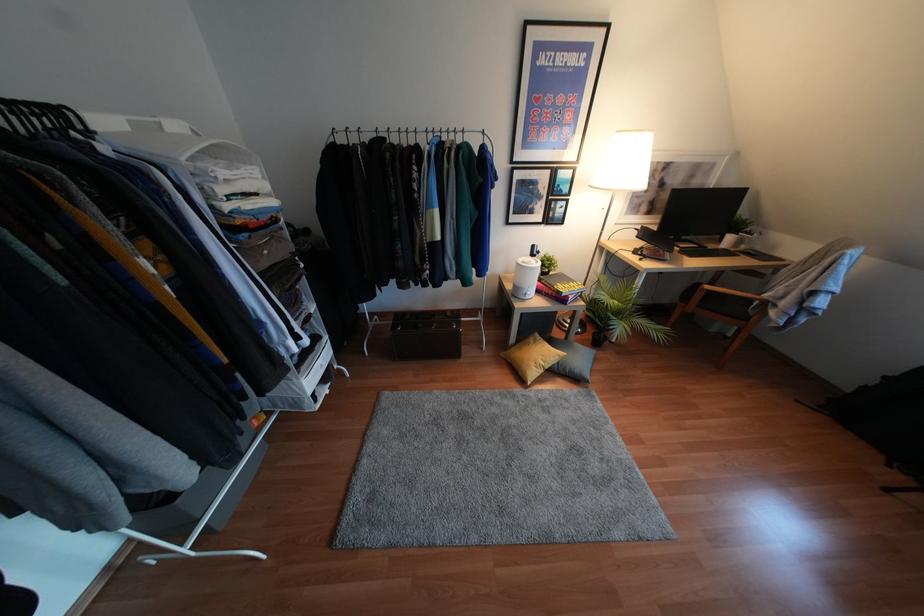
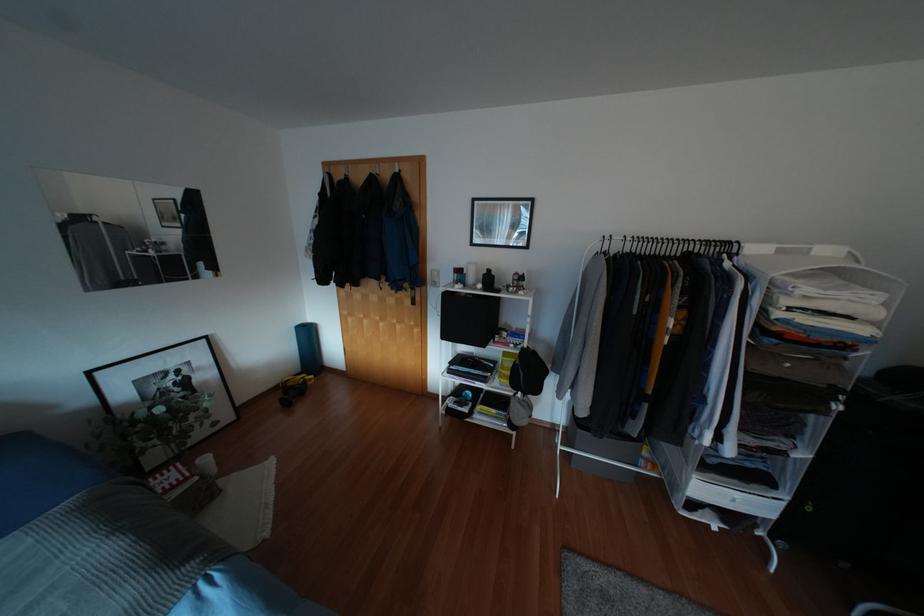
First-person continuous shooting, in which direction is the camera rotating?

The rotation direction of the camera is left-down.